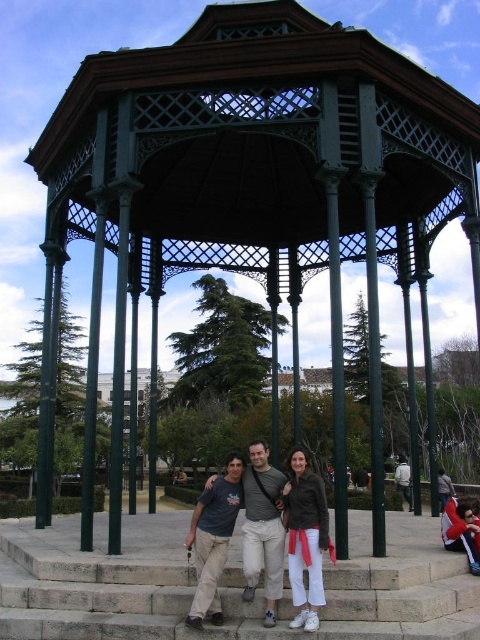
Question: In this image, where is gray cotton t-shirt at center located relative to white matte jacket at center?

Choices:
 (A) left
 (B) right

Answer: (A)

Question: Does matte brown jacket at center have a larger size compared to gray cotton t-shirt at center?

Choices:
 (A) no
 (B) yes

Answer: (A)

Question: Which point appears closest to the camera in this image?

Choices:
 (A) (408, 499)
 (B) (274, 621)
 (C) (312, 577)

Answer: (B)

Question: Based on their relative distances, which object is farther from the matte brown jacket at center?

Choices:
 (A) dark gray t-shirt at center
 (B) white matte jacket at center

Answer: (B)

Question: Which point is closer to the camera?

Choices:
 (A) (217, 488)
 (B) (268, 493)

Answer: (B)

Question: Does matte brown jacket at center come in front of gray cotton t-shirt at center?

Choices:
 (A) no
 (B) yes

Answer: (B)